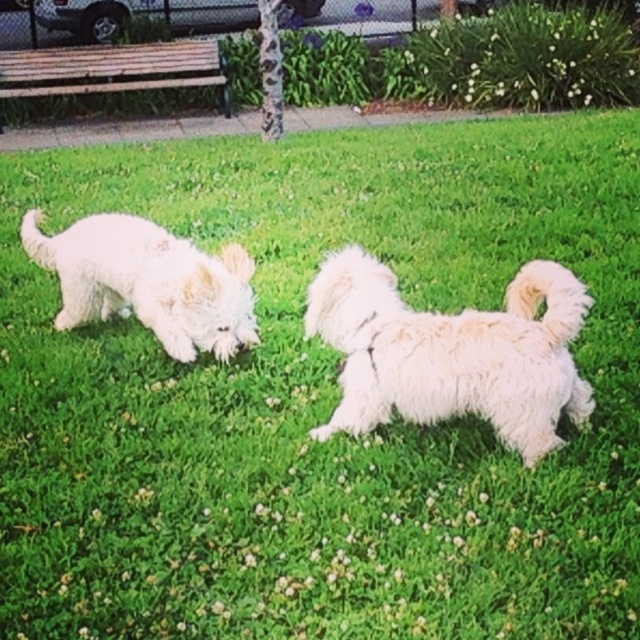
How much distance is there between white fluffy dog at center and white fluffy dog at left?

3.55 feet

The image size is (640, 640). Identify the location of white fluffy dog at center. (451, 353).

Where is `white fluffy dog at center`? Image resolution: width=640 pixels, height=640 pixels. white fluffy dog at center is located at coordinates (451, 353).